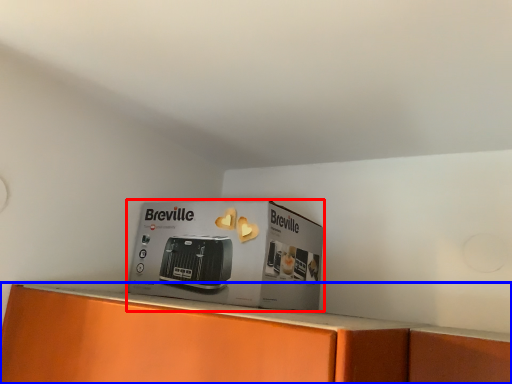
Question: Which object is further to the camera taking this photo, cardboard box (highlighted by a red box) or home appliance (highlighted by a blue box)?

Choices:
 (A) cardboard box
 (B) home appliance

Answer: (B)